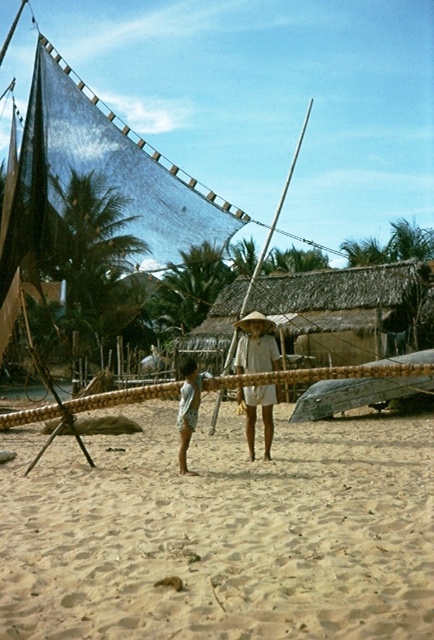
Question: Based on their relative distances, which object is nearer to the light blue cotton shorts at center?

Choices:
 (A) white woven hat at center
 (B) light beige sand at center

Answer: (A)

Question: Is the position of light beige sand at center more distant than that of white woven hat at center?

Choices:
 (A) no
 (B) yes

Answer: (A)

Question: Which object is the closest to the white woven hat at center?

Choices:
 (A) light blue cotton shorts at center
 (B) light beige sand at center

Answer: (A)

Question: Can you confirm if light beige sand at center is positioned below white woven hat at center?

Choices:
 (A) yes
 (B) no

Answer: (A)

Question: Which object is positioned closest to the light beige sand at center?

Choices:
 (A) white woven hat at center
 (B) light blue cotton shorts at center

Answer: (A)

Question: Does light beige sand at center appear on the left side of white woven hat at center?

Choices:
 (A) yes
 (B) no

Answer: (A)